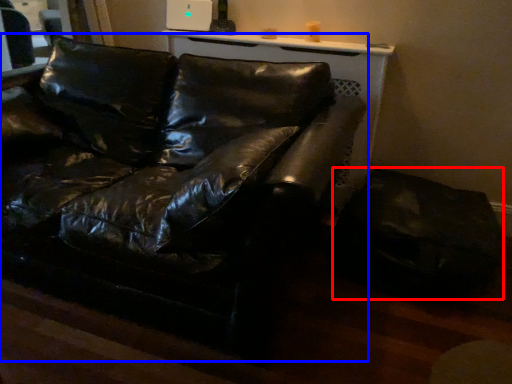
Question: Among these objects, which one is farthest to the camera, swivel chair (highlighted by a red box) or studio couch (highlighted by a blue box)?

Choices:
 (A) swivel chair
 (B) studio couch

Answer: (A)